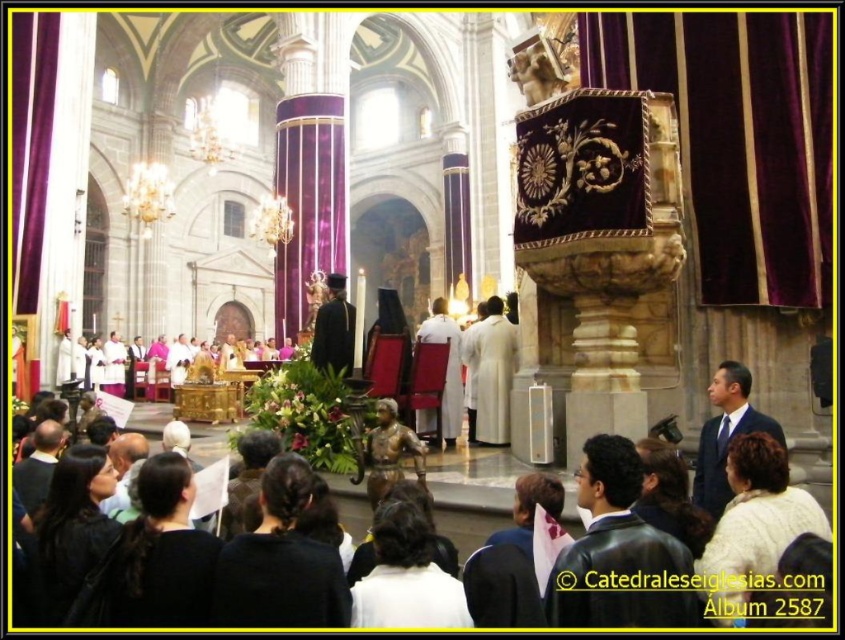
Question: Can you confirm if black leather jacket at lower center is positioned to the right of white matte robe at lower center?

Choices:
 (A) yes
 (B) no

Answer: (A)

Question: Can you confirm if white matte robe at lower right is smaller than white cloth at center?

Choices:
 (A) no
 (B) yes

Answer: (B)

Question: Which object is positioned closest to the white cloth at center?

Choices:
 (A) white matte robe at center
 (B) black matte robe at lower center
 (C) white matte robe at lower center

Answer: (A)

Question: Is black matte robe at lower center to the right of white matte robe at lower center from the viewer's perspective?

Choices:
 (A) no
 (B) yes

Answer: (A)

Question: Which is farther from the white matte robe at lower center?

Choices:
 (A) black leather jacket at lower center
 (B) dark brown leather jacket at lower left

Answer: (B)

Question: Considering the real-world distances, which object is farthest from the black leather jacket at lower center?

Choices:
 (A) white matte robe at center
 (B) dark brown leather jacket at lower left
 (C) white cloth at center
 (D) black velvet robe at center

Answer: (C)